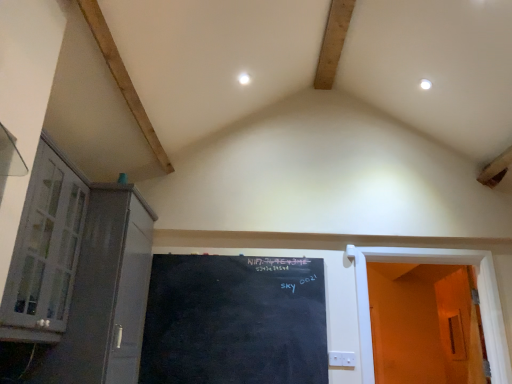
Where is `matte gray cabinet at left`? matte gray cabinet at left is located at coordinates (87, 272).

Describe the element at coordinates (461, 328) in the screenshot. I see `orange matte door at right, the second door from the left` at that location.

Where is `white wooden door at right, which is counted as the 1th door, starting from the left`? This screenshot has height=384, width=512. white wooden door at right, which is counted as the 1th door, starting from the left is located at coordinates (411, 262).

Where is `white glass cabinet at left`? Image resolution: width=512 pixels, height=384 pixels. white glass cabinet at left is located at coordinates (45, 251).

The height and width of the screenshot is (384, 512). Find the location of `black chalkboard at center`. black chalkboard at center is located at coordinates (234, 321).

From the image's perspective, does orange matte door at right, the second door from the left, appear higher than white glass cabinet at left?

No, from the image's perspective, orange matte door at right, the second door from the left, is not over white glass cabinet at left.

How much distance is there between orange matte door at right, the 1th door viewed from the right, and white glass cabinet at left?

2.78 meters.

Does orange matte door at right, the 1th door viewed from the right, lie in front of white glass cabinet at left?

No, orange matte door at right, the 1th door viewed from the right, is further to the viewer.

Is orange matte door at right, the 1th door viewed from the right, with white glass cabinet at left?

No, orange matte door at right, the 1th door viewed from the right, is not beside white glass cabinet at left.

Identify the location of cabinetry lying in front of the orange matte door at right, the 1th door viewed from the right. The image size is (512, 384). (87, 272).

From the image's perspective, would you say orange matte door at right, the 1th door viewed from the right, is positioned over matte gray cabinet at left?

No.

Are orange matte door at right, the 1th door viewed from the right, and matte gray cabinet at left beside each other?

No, orange matte door at right, the 1th door viewed from the right, is not next to matte gray cabinet at left.

Considering the relative positions of orange matte door at right, the 1th door viewed from the right, and matte gray cabinet at left in the image provided, is orange matte door at right, the 1th door viewed from the right, in front of matte gray cabinet at left?

No, orange matte door at right, the 1th door viewed from the right, is further to the viewer.

In the image, is white wooden door at right, the 2th door viewed from the right, positioned in front of or behind orange matte door at right, the 1th door viewed from the right?

In the image, white wooden door at right, the 2th door viewed from the right, appears in front of orange matte door at right, the 1th door viewed from the right.

Is white wooden door at right, the 2th door viewed from the right, not inside orange matte door at right, the 1th door viewed from the right?

white wooden door at right, the 2th door viewed from the right, lies outside orange matte door at right, the 1th door viewed from the right,'s area.

Considering the sizes of white wooden door at right, the 2th door viewed from the right, and orange matte door at right, the 1th door viewed from the right, in the image, is white wooden door at right, the 2th door viewed from the right, wider or thinner than orange matte door at right, the 1th door viewed from the right,?

Considering their sizes, white wooden door at right, the 2th door viewed from the right, looks slimmer than orange matte door at right, the 1th door viewed from the right.

Looking at this image, is white wooden door at right, which is counted as the 1th door, starting from the left, oriented towards orange matte door at right, the 1th door viewed from the right?

No, white wooden door at right, which is counted as the 1th door, starting from the left, does not turn towards orange matte door at right, the 1th door viewed from the right.

How many degrees apart are the facing directions of white wooden door at right, the 2th door viewed from the right, and white glass cabinet at left?

The facing directions of white wooden door at right, the 2th door viewed from the right, and white glass cabinet at left are 90.1 degrees apart.

Considering the positions of objects white wooden door at right, which is counted as the 1th door, starting from the left, and white glass cabinet at left in the image provided, who is more to the left, white wooden door at right, which is counted as the 1th door, starting from the left, or white glass cabinet at left?

white glass cabinet at left.

Is white wooden door at right, the 2th door viewed from the right, positioned with its back to white glass cabinet at left?

white wooden door at right, the 2th door viewed from the right, is not turned away from white glass cabinet at left.

Does white wooden door at right, the 2th door viewed from the right, lie behind white glass cabinet at left?

Yes, white wooden door at right, the 2th door viewed from the right, is further from the camera.

Who is bigger, white glass cabinet at left or orange matte door at right, the 1th door viewed from the right?

With larger size is white glass cabinet at left.

Looking at this image, from the image's perspective, which one is positioned lower, white glass cabinet at left or orange matte door at right, the 1th door viewed from the right?

orange matte door at right, the 1th door viewed from the right, is shown below in the image.

There is a white glass cabinet at left. Where is `the 2nd door below it (from the image's perspective)`? the 2nd door below it (from the image's perspective) is located at coordinates (461, 328).

How far apart are white glass cabinet at left and orange matte door at right, the second door from the left?

white glass cabinet at left and orange matte door at right, the second door from the left, are 9.14 feet apart from each other.

Does matte gray cabinet at left lie behind white glass cabinet at left?

Yes.

From the picture: Is matte gray cabinet at left positioned beyond the bounds of white glass cabinet at left?

matte gray cabinet at left is positioned outside white glass cabinet at left.

From the image's perspective, which is below, matte gray cabinet at left or white glass cabinet at left?

matte gray cabinet at left appears lower in the image.

From the image's perspective, is black chalkboard at center below matte gray cabinet at left?

Correct, black chalkboard at center appears lower than matte gray cabinet at left in the image.

Find the location of a particular element. bulletin board behind the matte gray cabinet at left is located at coordinates (234, 321).

From the picture: From a real-world perspective, between black chalkboard at center and matte gray cabinet at left, who is vertically lower?

In real-world perspective, black chalkboard at center is lower.

Is black chalkboard at center not near matte gray cabinet at left?

No, black chalkboard at center is not far from matte gray cabinet at left.

Where is `window positioned vertically above the orange matte door at right, the second door from the left (from a real-world perspective)`? This screenshot has width=512, height=384. window positioned vertically above the orange matte door at right, the second door from the left (from a real-world perspective) is located at coordinates (45, 251).

At what (x,y) coordinates should I click in order to perform the action: click on the 2nd door behind the matte gray cabinet at left, starting your count from the anchor. Please return your answer as a coordinate pair (x, y). Image resolution: width=512 pixels, height=384 pixels. Looking at the image, I should click on (461, 328).

Considering their positions, is matte gray cabinet at left positioned further to orange matte door at right, the 1th door viewed from the right, than black chalkboard at center?

matte gray cabinet at left is further to orange matte door at right, the 1th door viewed from the right.

Estimate the real-world distances between objects in this image. Which object is closer to black chalkboard at center, white glass cabinet at left or white wooden door at right, the 2th door viewed from the right?

white wooden door at right, the 2th door viewed from the right, is closer to black chalkboard at center.

When comparing their distances from matte gray cabinet at left, does black chalkboard at center or orange matte door at right, the second door from the left, seem further?

The object further to matte gray cabinet at left is orange matte door at right, the second door from the left.

In the scene shown: Considering their positions, is black chalkboard at center positioned further to white wooden door at right, the 2th door viewed from the right, than matte gray cabinet at left?

The object further to white wooden door at right, the 2th door viewed from the right, is matte gray cabinet at left.

From the image, which object appears to be farther from white glass cabinet at left, white wooden door at right, which is counted as the 1th door, starting from the left, or matte gray cabinet at left?

white wooden door at right, which is counted as the 1th door, starting from the left, is further to white glass cabinet at left.

Looking at the image, which one is located closer to white glass cabinet at left, orange matte door at right, the second door from the left, or black chalkboard at center?

black chalkboard at center is positioned closer to the anchor white glass cabinet at left.

From the image, which object appears to be farther from white wooden door at right, which is counted as the 1th door, starting from the left, orange matte door at right, the 1th door viewed from the right, or black chalkboard at center?

Based on the image, black chalkboard at center appears to be further to white wooden door at right, which is counted as the 1th door, starting from the left.

From the image, which object appears to be nearer to white glass cabinet at left, matte gray cabinet at left or orange matte door at right, the second door from the left?

matte gray cabinet at left is closer to white glass cabinet at left.

Image resolution: width=512 pixels, height=384 pixels. Identify the location of cabinetry situated between white glass cabinet at left and white wooden door at right, the 2th door viewed from the right, from left to right. (87, 272).

Locate an element on the screen. Image resolution: width=512 pixels, height=384 pixels. bulletin board between white glass cabinet at left and orange matte door at right, the 1th door viewed from the right, from left to right is located at coordinates (234, 321).

The width and height of the screenshot is (512, 384). I want to click on door between matte gray cabinet at left and orange matte door at right, the second door from the left, in the horizontal direction, so click(x=411, y=262).

Locate an element on the screen. This screenshot has height=384, width=512. bulletin board between matte gray cabinet at left and white wooden door at right, the 2th door viewed from the right is located at coordinates (234, 321).